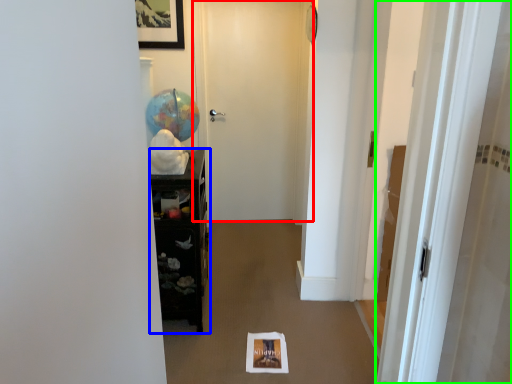
Question: Which object is positioned closest to door (highlighted by a red box)? Select from furniture (highlighted by a blue box) and door (highlighted by a green box).

Choices:
 (A) furniture
 (B) door

Answer: (A)